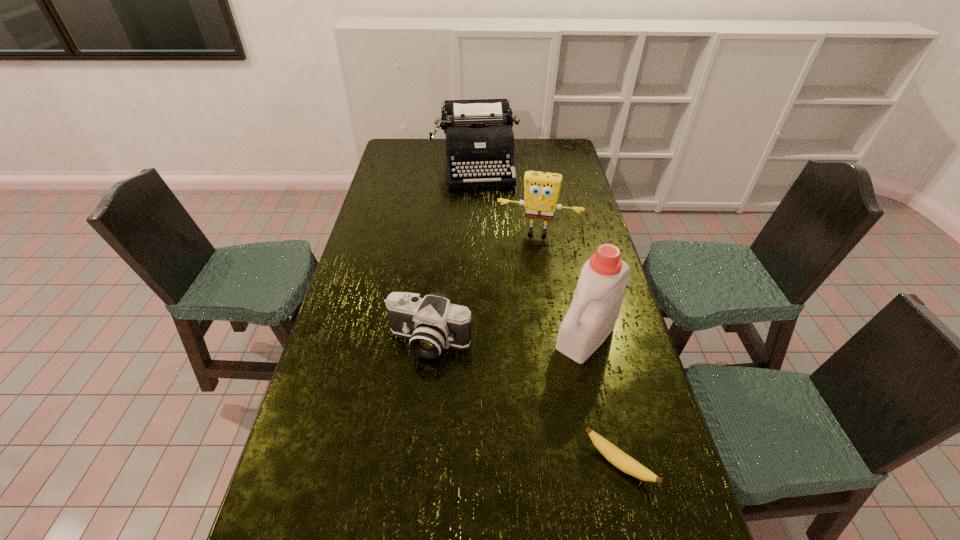
Point out which object is positioned as the third nearest to the farthest object. Please provide its 2D coordinates. Your answer should be formatted as a tuple, i.e. [(x, y)], where the tuple contains the x and y coordinates of a point satisfying the conditions above.

[(432, 323)]

Find the location of `vacant area that satisfies the following two spatial constraints: 1. on the back side of the camera; 2. on the left side of the detergent`. vacant area that satisfies the following two spatial constraints: 1. on the back side of the camera; 2. on the left side of the detergent is located at coordinates point(430,336).

The width and height of the screenshot is (960, 540). I want to click on vacant space that satisfies the following two spatial constraints: 1. on the back side of the camera; 2. on the left side of the typewriter, so click(448, 165).